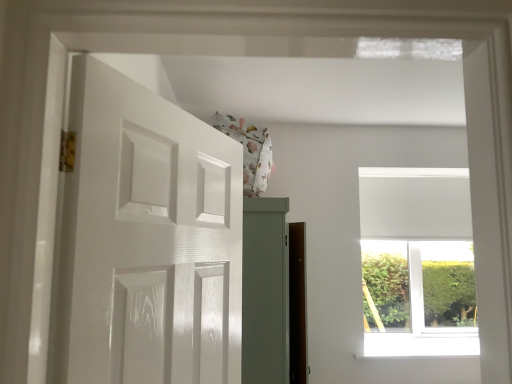
Question: Is white glossy door at left in contact with white smooth window sill at upper center?

Choices:
 (A) yes
 (B) no

Answer: (B)

Question: Considering the relative sizes of white glossy door at left and white smooth window sill at upper center in the image provided, is white glossy door at left taller than white smooth window sill at upper center?

Choices:
 (A) no
 (B) yes

Answer: (B)

Question: Is white smooth window sill at upper center surrounded by white glossy door at left?

Choices:
 (A) yes
 (B) no

Answer: (B)

Question: Does white glossy door at left appear on the right side of white smooth window sill at upper center?

Choices:
 (A) no
 (B) yes

Answer: (A)

Question: Is the depth of white glossy door at left greater than that of white smooth window sill at upper center?

Choices:
 (A) yes
 (B) no

Answer: (B)

Question: Can you confirm if white glossy door at left is bigger than white smooth window sill at upper center?

Choices:
 (A) yes
 (B) no

Answer: (A)

Question: Considering the relative sizes of white smooth window sill at upper center and white matte window at upper right in the image provided, is white smooth window sill at upper center taller than white matte window at upper right?

Choices:
 (A) no
 (B) yes

Answer: (A)

Question: Does white smooth window sill at upper center appear on the left side of white matte window at upper right?

Choices:
 (A) no
 (B) yes

Answer: (B)

Question: Considering the relative sizes of white smooth window sill at upper center and white matte window at upper right in the image provided, is white smooth window sill at upper center wider than white matte window at upper right?

Choices:
 (A) no
 (B) yes

Answer: (B)

Question: From the image's perspective, is white smooth window sill at upper center beneath white matte window at upper right?

Choices:
 (A) no
 (B) yes

Answer: (B)

Question: Considering the relative sizes of white smooth window sill at upper center and white matte window at upper right in the image provided, is white smooth window sill at upper center shorter than white matte window at upper right?

Choices:
 (A) yes
 (B) no

Answer: (A)

Question: From the image's perspective, does white smooth window sill at upper center appear higher than white matte window at upper right?

Choices:
 (A) no
 (B) yes

Answer: (A)

Question: Is white smooth window sill at upper center closer to camera compared to white glossy door at left?

Choices:
 (A) no
 (B) yes

Answer: (A)